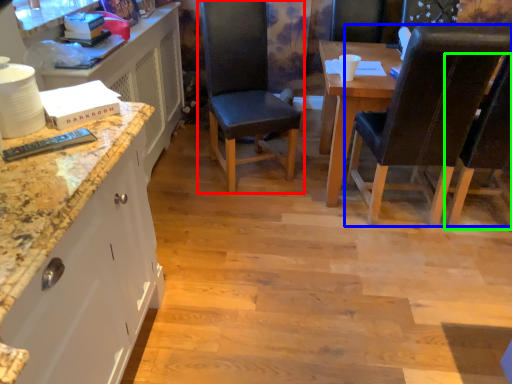
Question: Considering the real-world distances, which object is farthest from chair (highlighted by a red box)? chair (highlighted by a blue box) or chair (highlighted by a green box)?

Choices:
 (A) chair
 (B) chair

Answer: (B)